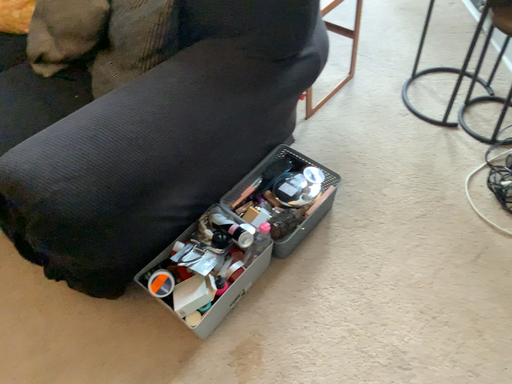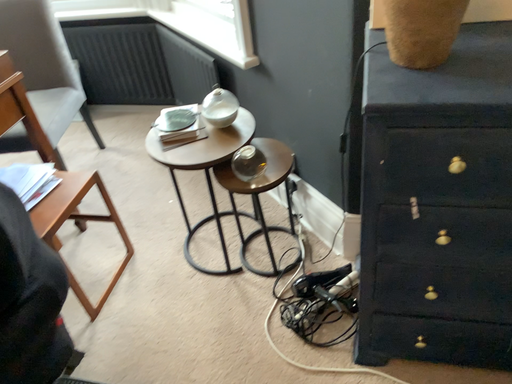
Question: Which way did the camera rotate in the video?

Choices:
 (A) rotated left
 (B) rotated right

Answer: (B)